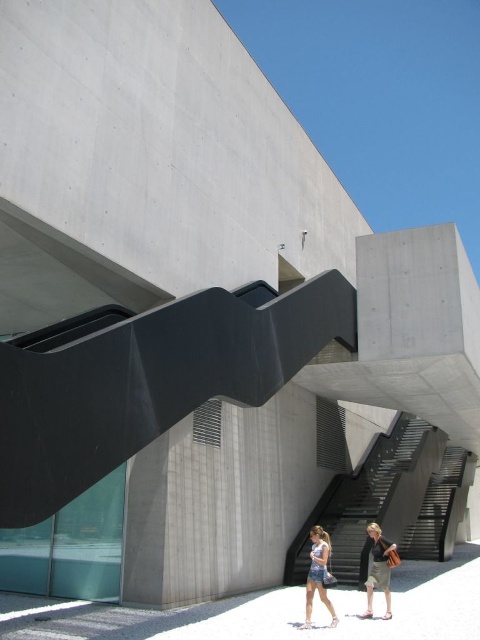
Question: Is light brown sandal at lower right below denim shorts at lower center?

Choices:
 (A) no
 (B) yes

Answer: (B)

Question: Is denim shorts at center closer to camera compared to denim shorts at lower center?

Choices:
 (A) yes
 (B) no

Answer: (B)

Question: Which object appears closest to the camera in this image?

Choices:
 (A) denim shorts at center
 (B) light brown sandal at lower right
 (C) denim shorts at lower center
 (D) black textured stairs at center

Answer: (C)

Question: Which object appears closest to the camera in this image?

Choices:
 (A) denim shorts at lower center
 (B) light brown sandal at lower right
 (C) black textured stairs at center

Answer: (A)

Question: Where is denim shorts at center located in relation to denim shorts at lower center in the image?

Choices:
 (A) below
 (B) above

Answer: (B)

Question: Which object appears closest to the camera in this image?

Choices:
 (A) denim shorts at lower center
 (B) black textured stairs at center
 (C) light brown sandal at lower right

Answer: (A)